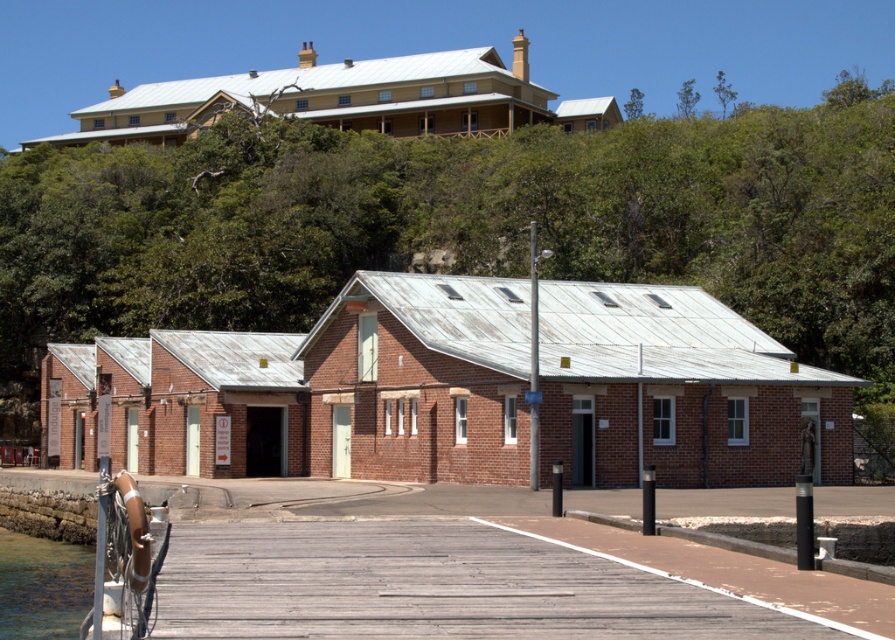
You are standing at the origin point of the scene. Based on the coordinates provided, in which direction should you move to reach the wooden planks at center?

The wooden planks at center are located at coordinates point (x=482, y=582), so you should move towards the right and forward to reach them.

You are a maintenance worker inspecting the wooden planks at center and clear water at dock lower left. Which object is positioned higher in elevation?

The wooden planks at center are positioned higher in elevation than the clear water at dock lower left as they are located above it.

Consider the image. You are a maintenance worker inspecting the waterfront area. You need to determine which area requires more attention based on their sizes. Which area should you prioritize? The wooden planks at center or the clear water at dock lower left?

The wooden planks at center is smaller than clear water at dock lower left, so you should prioritize the clear water at dock lower left since it covers a larger area and may require more attention.